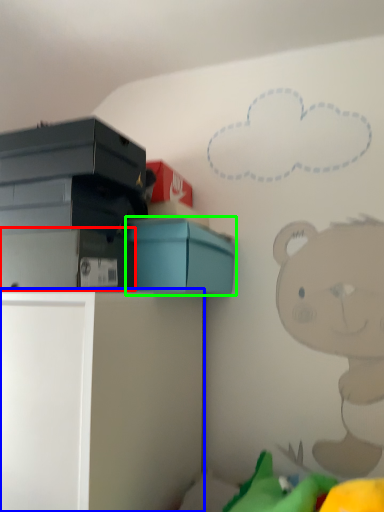
Question: Which object is the closest to the storage box (highlighted by a red box)? Choose among these: furniture (highlighted by a blue box) or box (highlighted by a green box).

Choices:
 (A) furniture
 (B) box

Answer: (B)